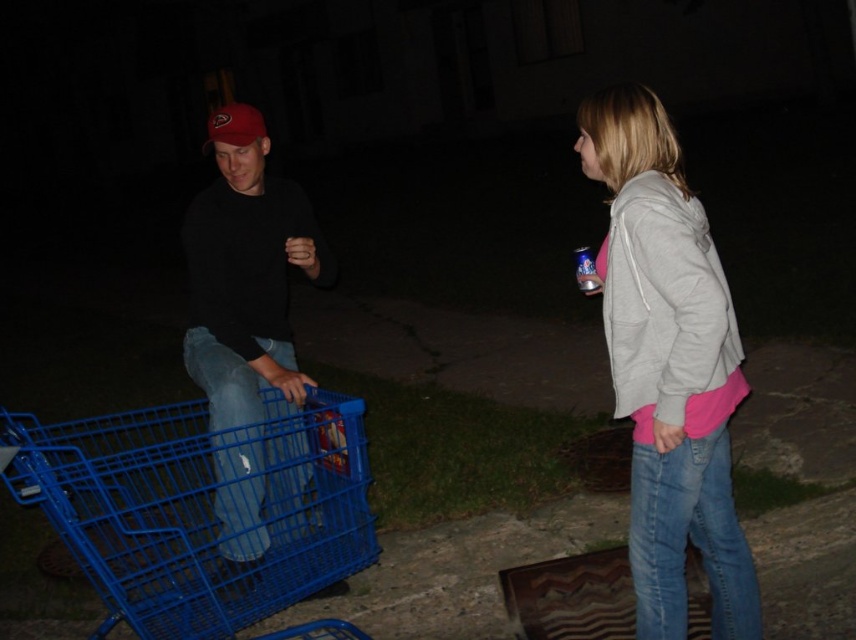
Question: Which of the following is the closest to the observer?

Choices:
 (A) (282, 348)
 (B) (209, 593)
 (C) (733, 513)

Answer: (B)

Question: Which is nearer to the matte black shirt at center?

Choices:
 (A) blue plastic shopping cart at lower left
 (B) light gray hoodie at upper right

Answer: (A)

Question: Which object appears closest to the camera in this image?

Choices:
 (A) blue plastic shopping cart at lower left
 (B) light gray hoodie at upper right

Answer: (A)

Question: Is light gray hoodie at upper right wider than matte black shirt at center?

Choices:
 (A) yes
 (B) no

Answer: (B)

Question: Does blue plastic shopping cart at lower left come behind light gray hoodie at upper right?

Choices:
 (A) no
 (B) yes

Answer: (A)

Question: Does blue plastic shopping cart at lower left appear on the left side of light gray hoodie at upper right?

Choices:
 (A) no
 (B) yes

Answer: (B)